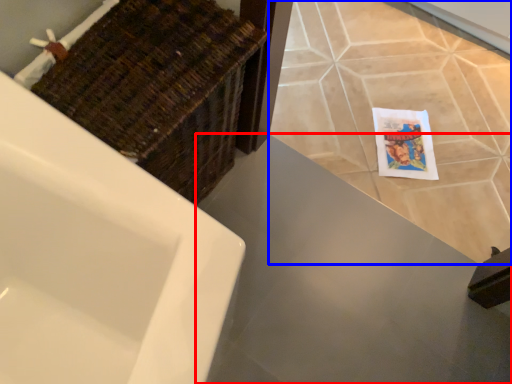
Question: Which point is closer to the camera, counter top (highlighted by a red box) or ceramic tile (highlighted by a blue box)?

Choices:
 (A) counter top
 (B) ceramic tile

Answer: (A)